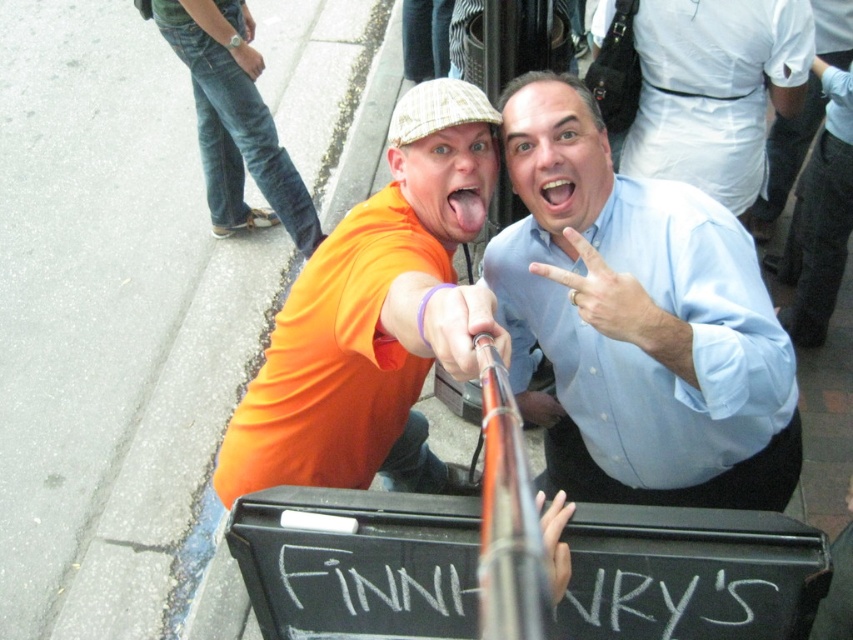
Question: Can you confirm if denim jeans at left is wider than white matte hand at upper center?

Choices:
 (A) no
 (B) yes

Answer: (B)

Question: Which is nearer to the orange matte shirt at center?

Choices:
 (A) gray asphalt at lower left
 (B) beige textured cap at center
 (C) smooth pink tongue at center
 (D) white matte hand at upper center

Answer: (C)

Question: Which point is farther to the camera?

Choices:
 (A) gray asphalt at lower left
 (B) smooth skin hand at upper center
 (C) white matte hand at center

Answer: (B)

Question: Which point is closer to the camera?

Choices:
 (A) (315, 234)
 (B) (554, 412)
 (C) (566, 237)
 (D) (71, 253)

Answer: (C)

Question: Is gray asphalt at lower left to the left of purple rubber band at upper center from the viewer's perspective?

Choices:
 (A) no
 (B) yes

Answer: (B)

Question: Does orange matte shirt at center appear under white cotton shirt at upper center?

Choices:
 (A) yes
 (B) no

Answer: (A)